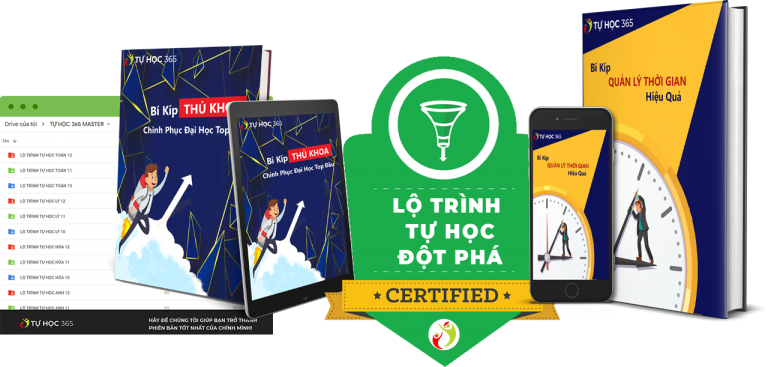
At what (x,y) coordinates should I click in order to perform the action: click on book. Please return your answer as a coordinate pair (x, y). Looking at the image, I should click on (216, 163).